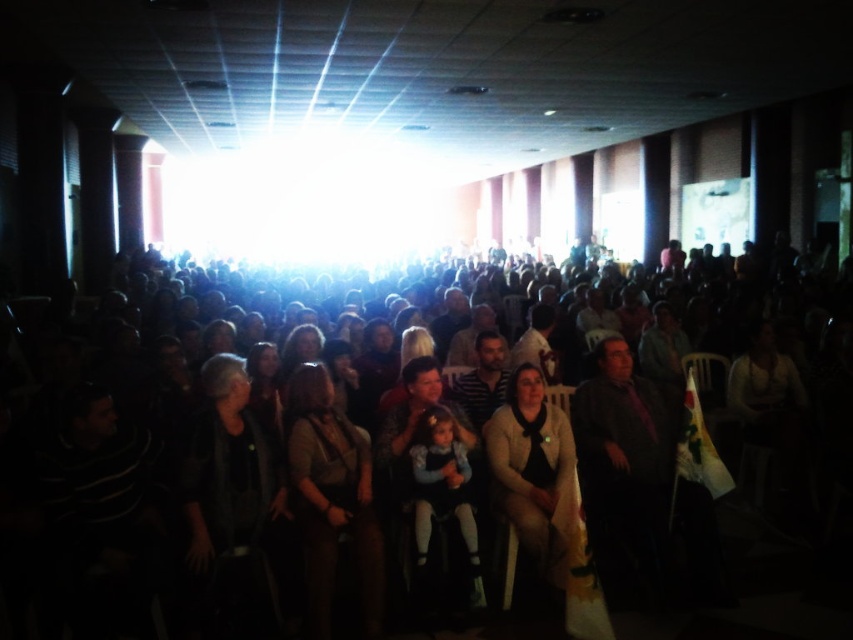
You are an event organizer who needs to ensure that all attendees have enough space between their seats. You notice two individuals wearing a light beige sweater at center and a dark gray fabric jacket at center. Which attendee requires a wider seat to accommodate their clothing?

The dark gray fabric jacket at center requires a wider seat because it has a greater width compared to the light beige sweater at center.

You are sitting in the front row of the conference hall and notice two people in the middle of the audience. One is wearing a light beige sweater at center, and the other has a dark gray fabric jacket at center. Which clothing item is closer to the floor?

The light beige sweater at center is positioned under the dark gray fabric jacket at center, meaning it is closer to the floor.